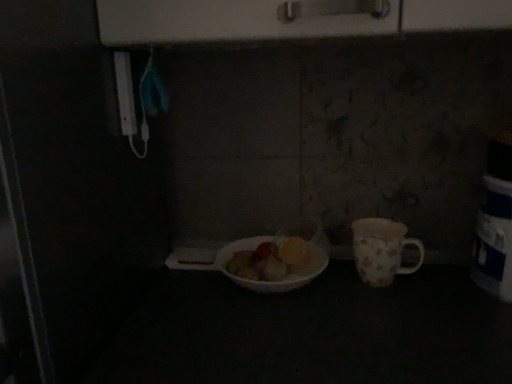
Question: From the image's perspective, is white glossy bowl at center beneath floral porcelain mug at right?

Choices:
 (A) no
 (B) yes

Answer: (B)

Question: From a real-world perspective, is white glossy bowl at center physically above floral porcelain mug at right?

Choices:
 (A) yes
 (B) no

Answer: (B)

Question: Is white glossy bowl at center closer to camera compared to floral porcelain mug at right?

Choices:
 (A) yes
 (B) no

Answer: (A)

Question: Can floral porcelain mug at right be found inside white glossy bowl at center?

Choices:
 (A) no
 (B) yes

Answer: (A)

Question: Is white glossy bowl at center next to floral porcelain mug at right and touching it?

Choices:
 (A) yes
 (B) no

Answer: (B)

Question: Is white glossy bowl at center to the right of floral porcelain mug at right from the viewer's perspective?

Choices:
 (A) no
 (B) yes

Answer: (A)

Question: Is floral porcelain mug at right far away from white glossy bowl at center?

Choices:
 (A) yes
 (B) no

Answer: (B)

Question: Is floral porcelain mug at right to the right of white glossy bowl at center from the viewer's perspective?

Choices:
 (A) yes
 (B) no

Answer: (A)

Question: Is floral porcelain mug at right wider than white glossy bowl at center?

Choices:
 (A) yes
 (B) no

Answer: (B)

Question: Does floral porcelain mug at right have a smaller size compared to white glossy bowl at center?

Choices:
 (A) yes
 (B) no

Answer: (A)

Question: From the image's perspective, does floral porcelain mug at right appear lower than white glossy bowl at center?

Choices:
 (A) yes
 (B) no

Answer: (B)

Question: From a real-world perspective, is floral porcelain mug at right positioned over white glossy bowl at center based on gravity?

Choices:
 (A) no
 (B) yes

Answer: (B)

Question: Considering the positions of point (379, 279) and point (238, 279), is point (379, 279) closer or farther from the camera than point (238, 279)?

Choices:
 (A) farther
 (B) closer

Answer: (A)